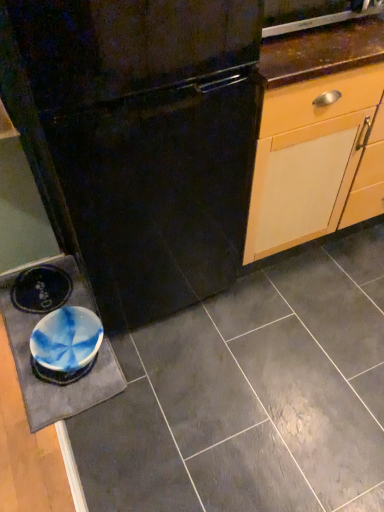
Question: Does black matte refrigerator at center lie behind matte ceramic tile at center?

Choices:
 (A) no
 (B) yes

Answer: (A)

Question: Is black matte refrigerator at center to the right of matte ceramic tile at center from the viewer's perspective?

Choices:
 (A) yes
 (B) no

Answer: (B)

Question: Does black matte refrigerator at center have a lesser height compared to matte ceramic tile at center?

Choices:
 (A) yes
 (B) no

Answer: (B)

Question: Is black matte refrigerator at center not close to matte ceramic tile at center?

Choices:
 (A) no
 (B) yes

Answer: (A)

Question: Does black matte refrigerator at center come in front of matte ceramic tile at center?

Choices:
 (A) no
 (B) yes

Answer: (B)

Question: From their relative heights in the image, would you say metallic stainless steel dishwasher at upper right is taller or shorter than matte ceramic tile at center?

Choices:
 (A) short
 (B) tall

Answer: (B)

Question: Is metallic stainless steel dishwasher at upper right situated inside matte ceramic tile at center or outside?

Choices:
 (A) inside
 (B) outside

Answer: (B)

Question: From the image's perspective, relative to matte ceramic tile at center, is metallic stainless steel dishwasher at upper right above or below?

Choices:
 (A) above
 (B) below

Answer: (A)

Question: Visually, is metallic stainless steel dishwasher at upper right positioned to the left or to the right of matte ceramic tile at center?

Choices:
 (A) right
 (B) left

Answer: (A)

Question: Is blue marbled slate at lower left wider or thinner than black matte refrigerator at center?

Choices:
 (A) thin
 (B) wide

Answer: (A)

Question: From their relative heights in the image, would you say blue marbled slate at lower left is taller or shorter than black matte refrigerator at center?

Choices:
 (A) tall
 (B) short

Answer: (B)

Question: Would you say blue marbled slate at lower left is to the left or to the right of black matte refrigerator at center in the picture?

Choices:
 (A) left
 (B) right

Answer: (A)

Question: Is blue marbled slate at lower left bigger or smaller than black matte refrigerator at center?

Choices:
 (A) big
 (B) small

Answer: (B)

Question: Considering the positions of black matte refrigerator at center and metallic stainless steel dishwasher at upper right in the image, is black matte refrigerator at center wider or thinner than metallic stainless steel dishwasher at upper right?

Choices:
 (A) wide
 (B) thin

Answer: (A)

Question: Considering the positions of point (43, 129) and point (284, 9), is point (43, 129) closer or farther from the camera than point (284, 9)?

Choices:
 (A) closer
 (B) farther

Answer: (A)